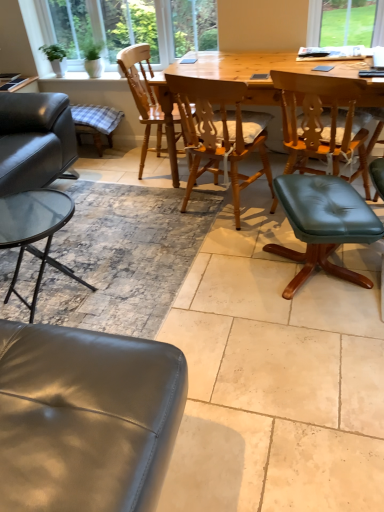
You are a GUI agent. You are given a task and a screenshot of the screen. Output one action in this format:
    pyautogui.click(x=<x>, y=<y>)
    Task: Click on the free spot below teal leather stool at center-right, placed as the first bar stool when sorted from front to back (from a real-world perspective)
    This screenshot has width=384, height=512.
    Given the screenshot: What is the action you would take?
    pyautogui.click(x=316, y=273)